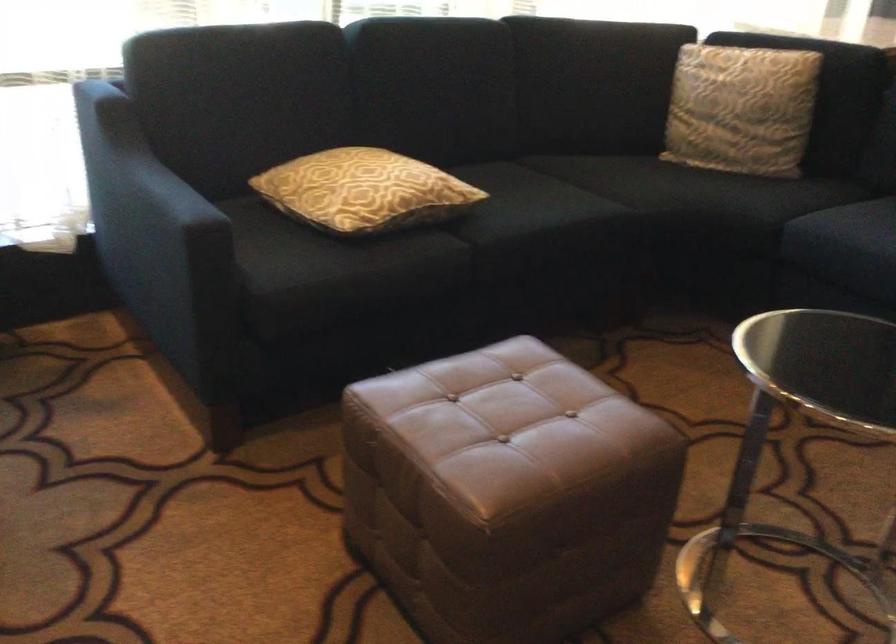
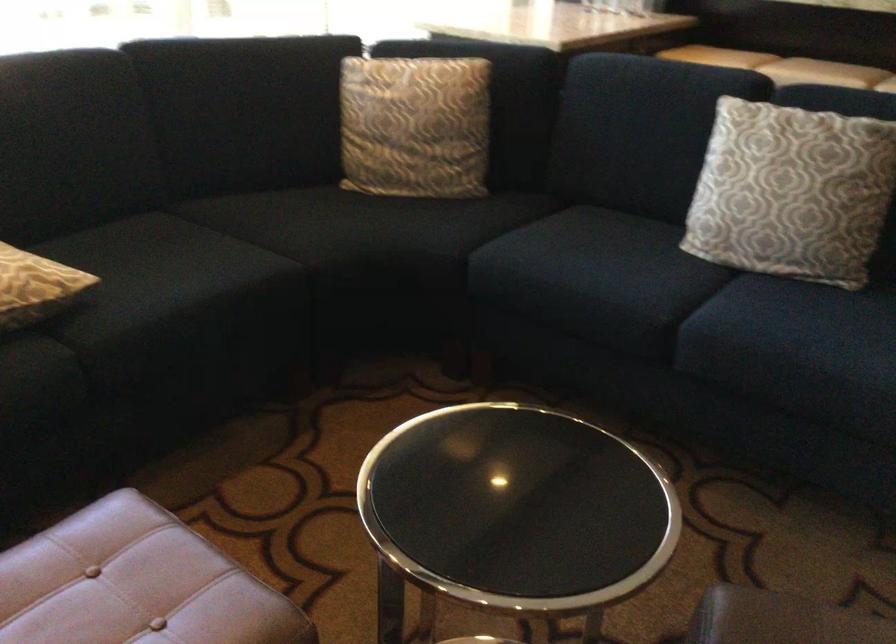
Locate, in the second image, the point that corresponds to point (743, 102) in the first image.

(415, 126)